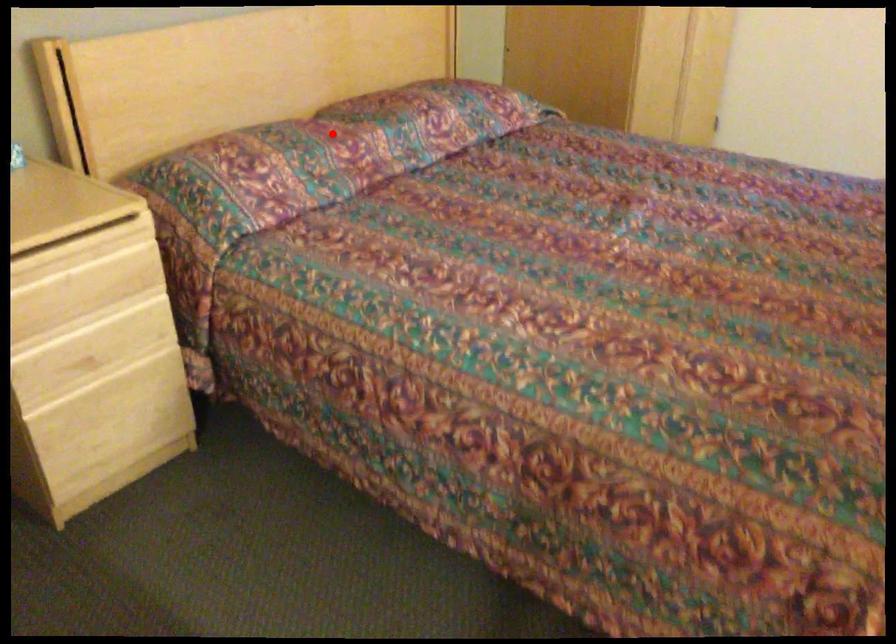
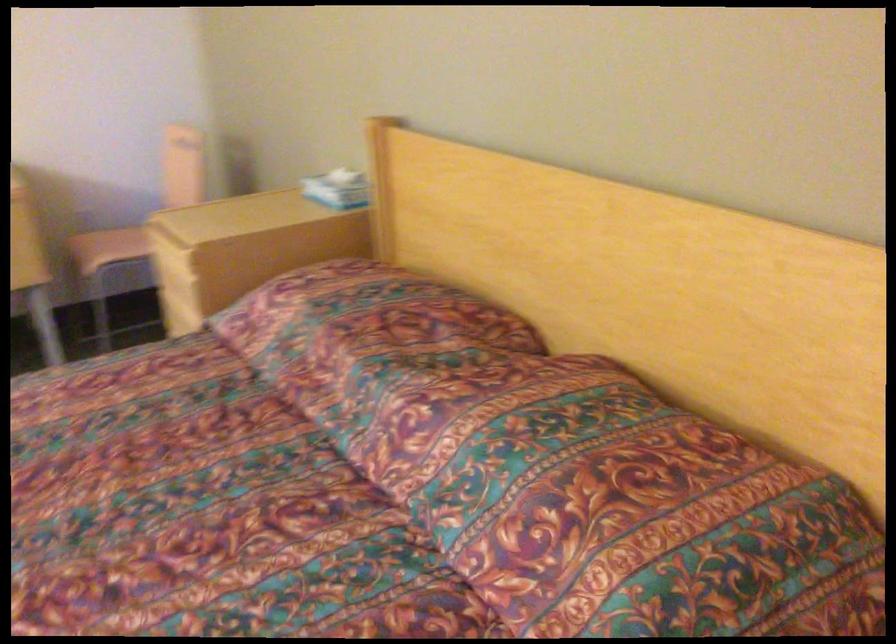
Where in the second image is the point corresponding to the highlighted location from the first image?

(354, 325)